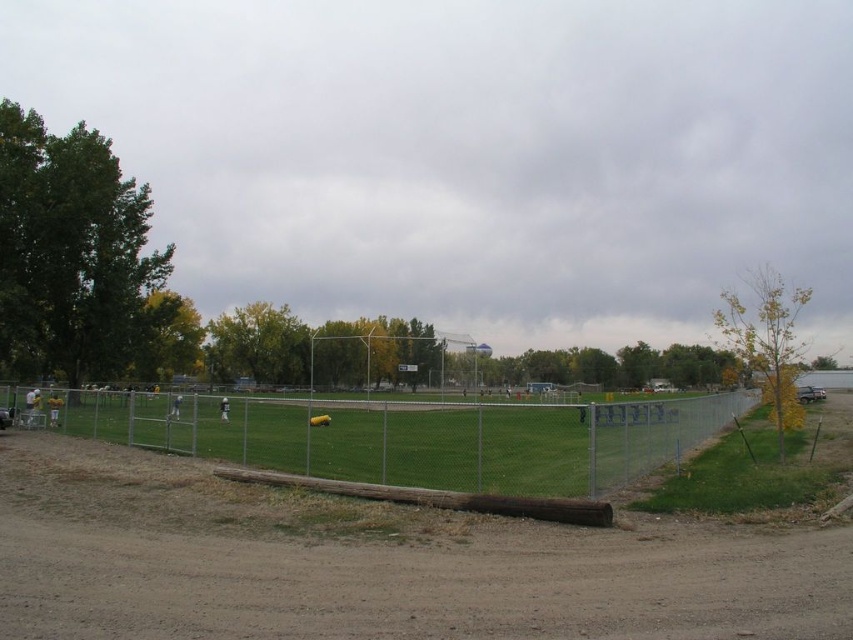
Does brown dirt field at center appear over silver chain-link fence at center?

Yes, brown dirt field at center is above silver chain-link fence at center.

Which is below, brown dirt field at center or silver chain-link fence at center?

silver chain-link fence at center is below.

Is point (102, 595) closer to viewer compared to point (479, 490)?

Yes, it is in front of point (479, 490).

In order to click on brown dirt field at center in this screenshot , I will do `click(373, 563)`.